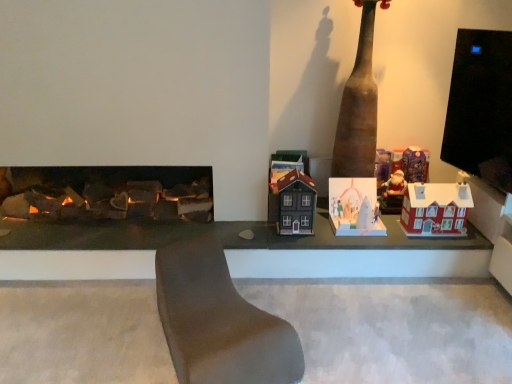
I want to click on blank space to the left of matte brown house at center, the 1th toy from the left, so click(267, 227).